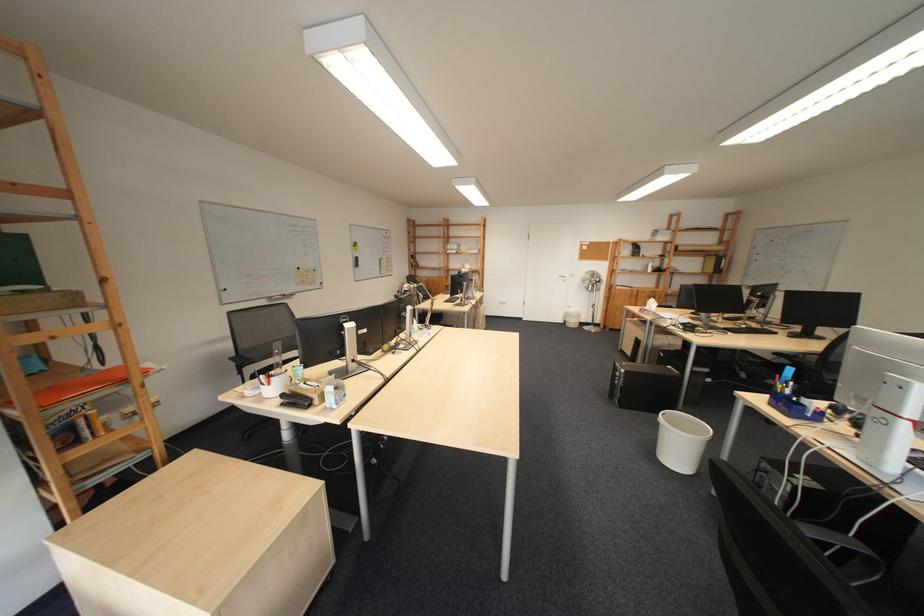
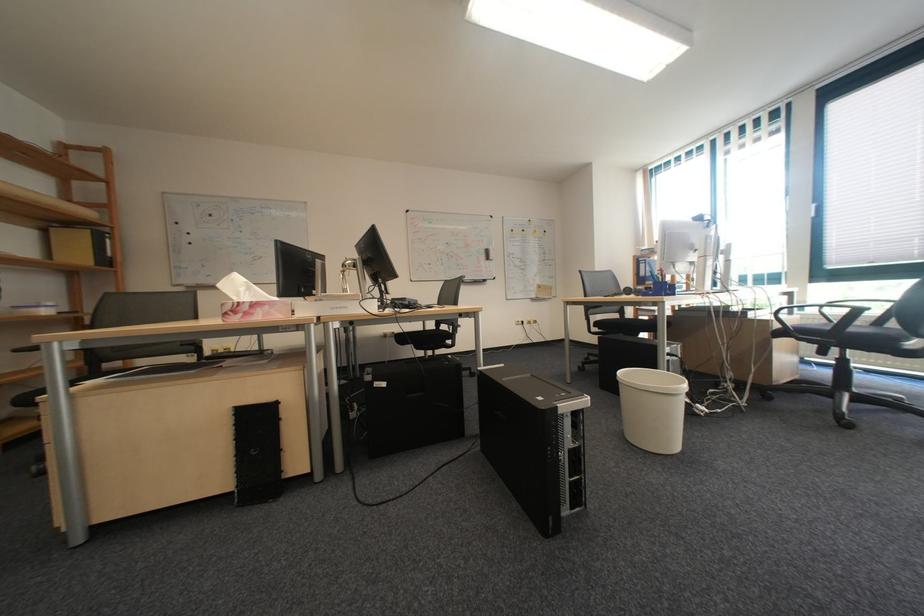
Locate, in the second image, the point that corresponds to [659,313] in the first image.

(273, 312)